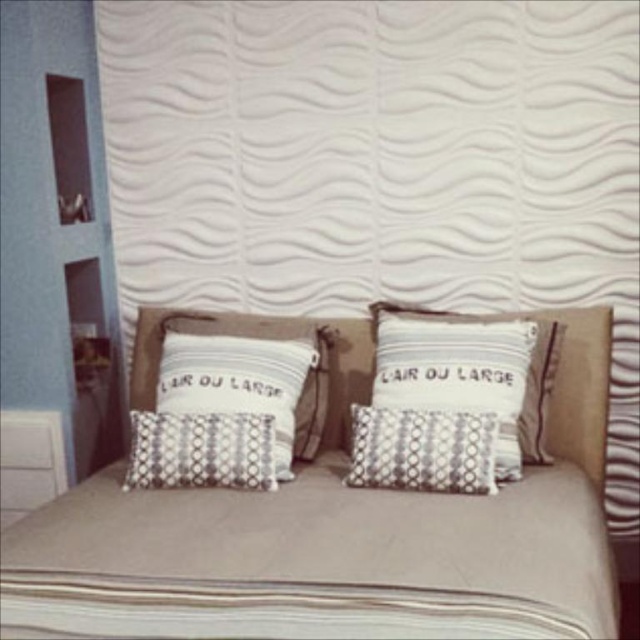
You are arranging two pillows on a bed. You have a white dotted pillow at center and a patterned fabric pillow at center. Which one do you need to adjust if you want the smaller pillow to be on the right side?

The patterned fabric pillow at center is smaller, so you should move it to the right side.

You are standing in the bedroom corner and want to determine which of the two points, point (476,120) or point (204,412), is closer to you. Based on the scene description, which point is nearer?

Point (476,120) is further to the viewer than point (204,412), so the point closer to you is point (204,412).

You are arranging a bed with two pillows. You have a white dotted pillow at center and a patterned fabric pillow at center. Which pillow should you place on the left side if you want the wider one to be on the right?

The white dotted pillow at center might be wider than the patterned fabric pillow at center, so place the white dotted pillow at center on the right side to have the wider one on the right.